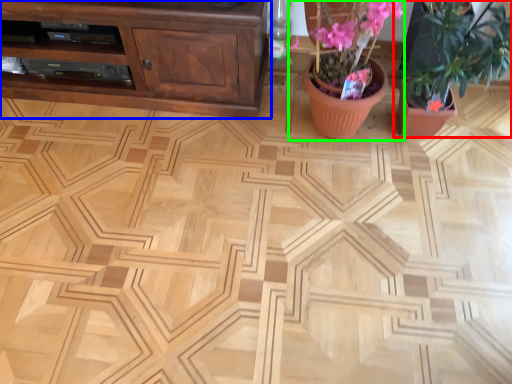
Question: Estimate the real-world distances between objects in this image. Which object is farther from houseplant (highlighted by a red box), cabinetry (highlighted by a blue box) or floral arrangement (highlighted by a green box)?

Choices:
 (A) cabinetry
 (B) floral arrangement

Answer: (A)